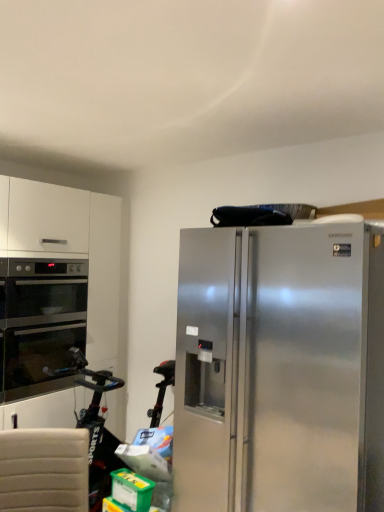
Question: Considering the positions of point (216, 234) and point (49, 377), is point (216, 234) closer or farther from the camera than point (49, 377)?

Choices:
 (A) closer
 (B) farther

Answer: (A)

Question: In the image, is stainless steel refrigerator at right positioned in front of or behind stainless steel oven at left?

Choices:
 (A) front
 (B) behind

Answer: (A)

Question: Considering the positions of stainless steel refrigerator at right and stainless steel oven at left in the image, is stainless steel refrigerator at right bigger or smaller than stainless steel oven at left?

Choices:
 (A) big
 (B) small

Answer: (A)

Question: In terms of height, does stainless steel oven at left look taller or shorter compared to stainless steel refrigerator at right?

Choices:
 (A) short
 (B) tall

Answer: (A)

Question: Would you say stainless steel oven at left is to the left or to the right of stainless steel refrigerator at right in the picture?

Choices:
 (A) right
 (B) left

Answer: (B)

Question: Choose the correct answer: Is stainless steel oven at left inside stainless steel refrigerator at right or outside it?

Choices:
 (A) outside
 (B) inside

Answer: (A)

Question: Is stainless steel oven at left wider or thinner than stainless steel refrigerator at right?

Choices:
 (A) thin
 (B) wide

Answer: (A)